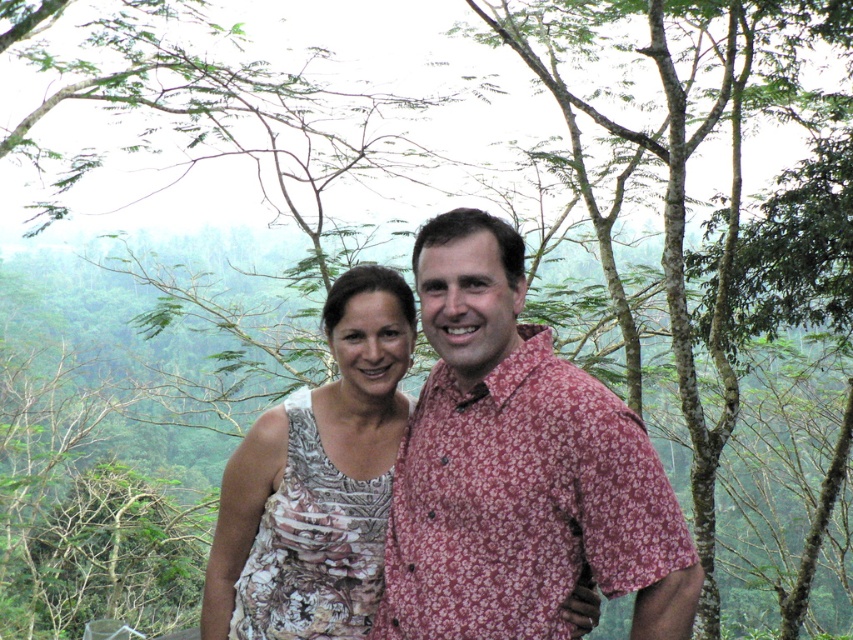
Question: Which point is farther to the camera?

Choices:
 (A) floral-patterned shirt at center
 (B) white floral dress at center

Answer: (B)

Question: Can you confirm if floral-patterned shirt at center is thinner than white floral dress at center?

Choices:
 (A) yes
 (B) no

Answer: (B)

Question: Is floral-patterned shirt at center smaller than white floral dress at center?

Choices:
 (A) yes
 (B) no

Answer: (B)

Question: From the image, what is the correct spatial relationship of floral-patterned shirt at center in relation to white floral dress at center?

Choices:
 (A) below
 (B) above

Answer: (B)

Question: Which object is farther from the camera taking this photo?

Choices:
 (A) floral-patterned shirt at center
 (B) white floral dress at center

Answer: (B)